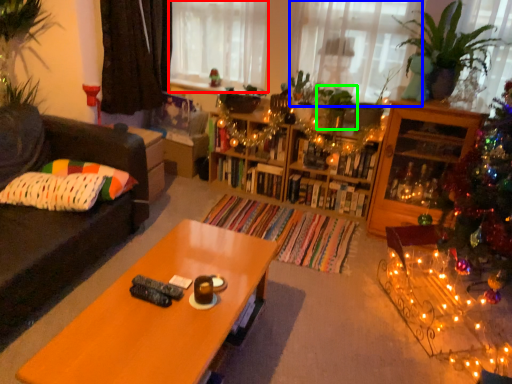
Question: Which is nearer to the window screen (highlighted by a red box)? window (highlighted by a blue box) or plant (highlighted by a green box).

Choices:
 (A) window
 (B) plant

Answer: (A)